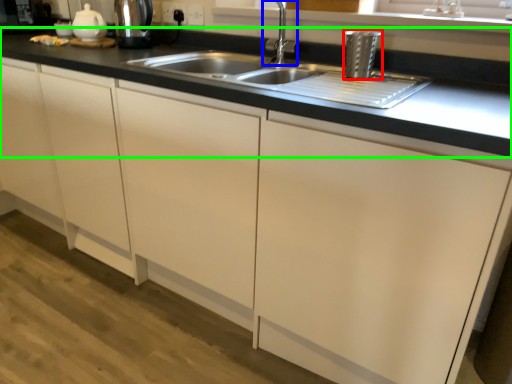
Question: Which object is positioned closest to appliance (highlighted by a red box)? Select from tap (highlighted by a blue box) and countertop (highlighted by a green box).

Choices:
 (A) tap
 (B) countertop

Answer: (A)